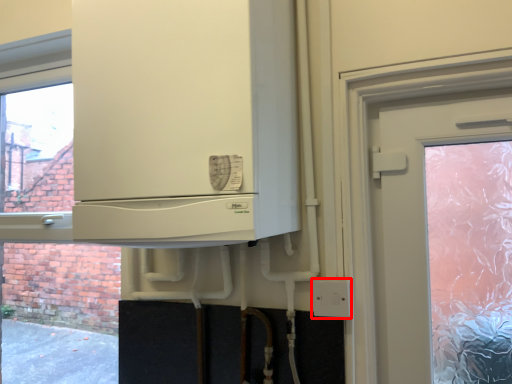
Question: From the image, what is the correct spatial relationship of electric outlet (annotated by the red box) in relation to cabinetry?

Choices:
 (A) right
 (B) left

Answer: (A)